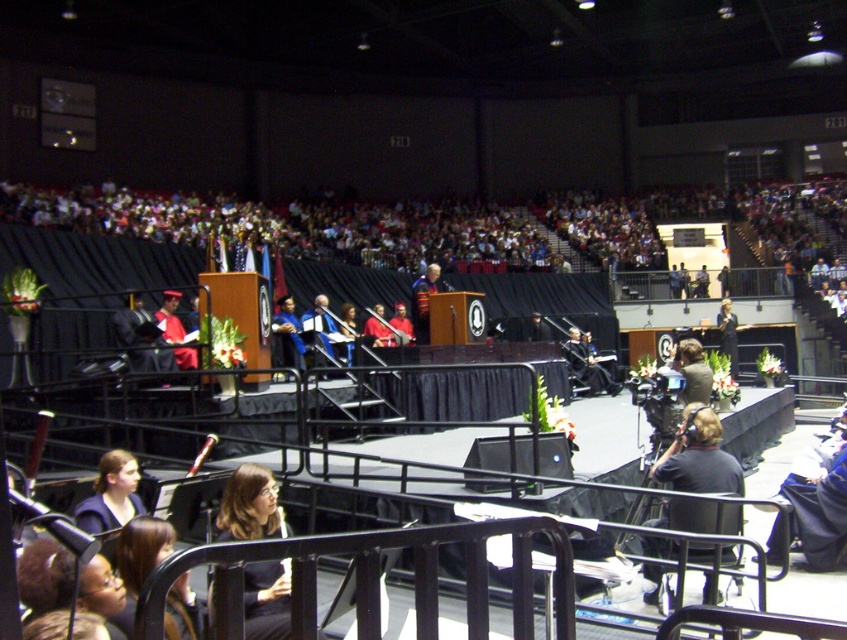
Question: Can you confirm if dark brown hair at lower left is bigger than knitted sweater at center?

Choices:
 (A) no
 (B) yes

Answer: (B)

Question: Does dark brown hair at lower left appear over knitted sweater at center?

Choices:
 (A) no
 (B) yes

Answer: (A)

Question: Does black fabric camera at lower right appear under knitted sweater at center?

Choices:
 (A) yes
 (B) no

Answer: (A)

Question: Which point is closer to the camera?

Choices:
 (A) knitted sweater at center
 (B) dark brown hair at lower left
 (C) black fabric camera at lower right

Answer: (B)

Question: Which of these objects is positioned farthest from the knitted sweater at center?

Choices:
 (A) dark brown hair at lower left
 (B) black fabric camera at lower right

Answer: (A)

Question: Which object is closer to the camera taking this photo?

Choices:
 (A) black fabric camera at lower right
 (B) dark brown hair at lower left

Answer: (B)